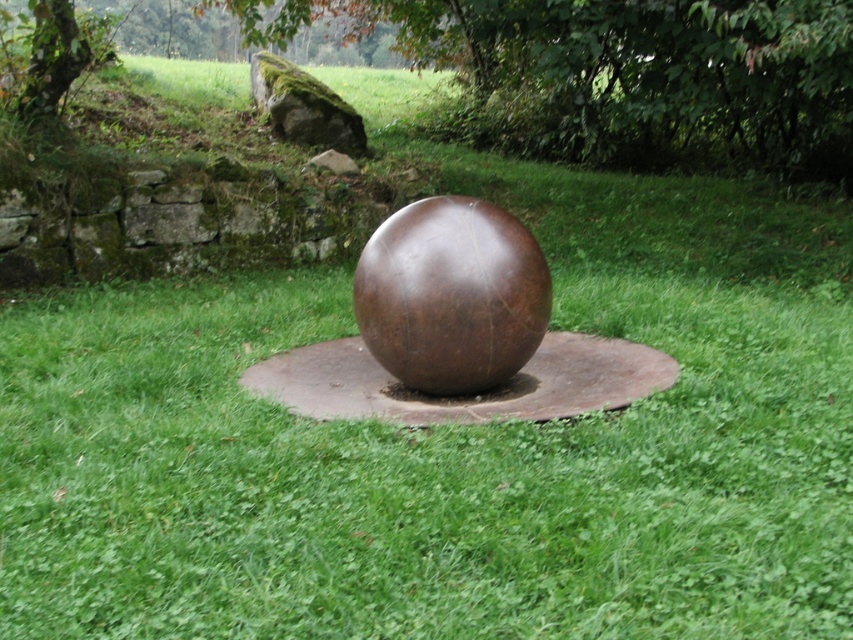
Looking at this image, can you confirm if brown leather sphere at center is bigger than mossy rock at upper left?

No, brown leather sphere at center is not bigger than mossy rock at upper left.

Does brown leather sphere at center have a greater width compared to mossy rock at upper left?

In fact, brown leather sphere at center might be narrower than mossy rock at upper left.

What do you see at coordinates (451, 296) in the screenshot?
I see `brown leather sphere at center` at bounding box center [451, 296].

Image resolution: width=853 pixels, height=640 pixels. Identify the location of brown leather sphere at center. (451, 296).